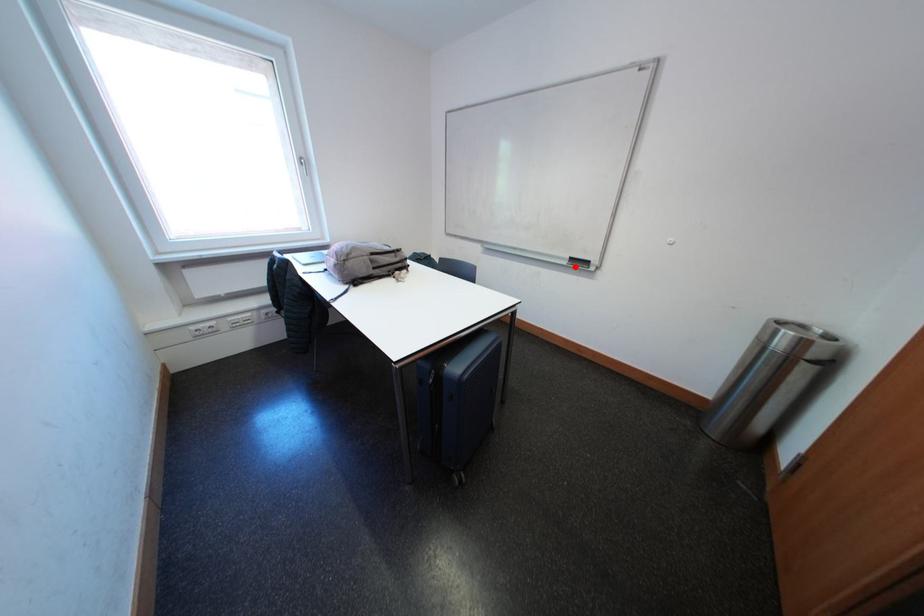
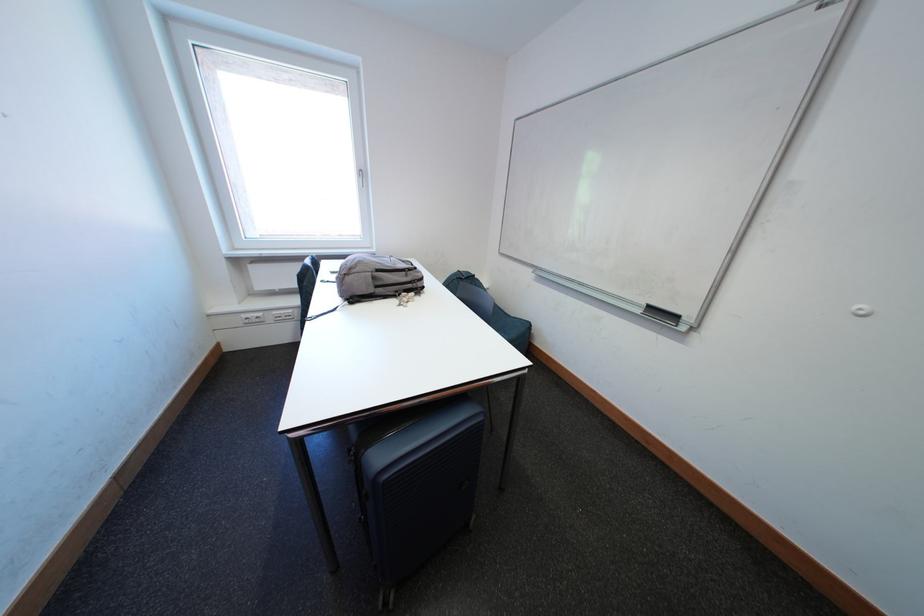
Where in the second image is the point corresponding to the highlighted location from the first image?

(649, 315)